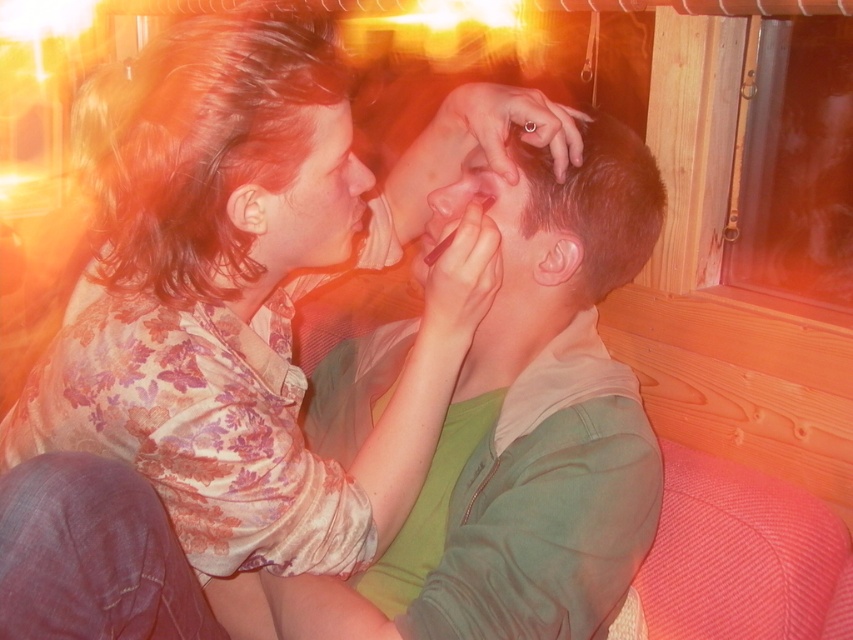
Is floral silk blouse at center further to camera compared to matte floral shirt at upper left?

No, floral silk blouse at center is closer to the viewer.

Which is behind, point (432, 337) or point (238, 193)?

The point (432, 337) is more distant.

Identify the location of floral silk blouse at center. [254, 298].

Who is shorter, matte floral shirt at upper left or matte skin at center?

Standing shorter between the two is matte floral shirt at upper left.

Is point (340, 216) in front of point (462, 164)?

That is True.

You are a GUI agent. You are given a task and a screenshot of the screen. Output one action in this format:
    pyautogui.click(x=<x>, y=<y>)
    Task: Click on the matte floral shirt at upper left
    The height and width of the screenshot is (640, 853).
    Given the screenshot: What is the action you would take?
    pyautogui.click(x=309, y=198)

Is point (172, 145) less distant than point (496, 182)?

Yes.

Measure the distance between point (279, 83) and camera.

Point (279, 83) and camera are 28.66 inches apart.

Locate an element on the screen. This screenshot has width=853, height=640. floral silk blouse at center is located at coordinates (254, 298).

You are a GUI agent. You are given a task and a screenshot of the screen. Output one action in this format:
    pyautogui.click(x=<x>, y=<y>)
    Task: Click on the floral silk blouse at center
    This screenshot has height=640, width=853.
    Given the screenshot: What is the action you would take?
    pyautogui.click(x=254, y=298)